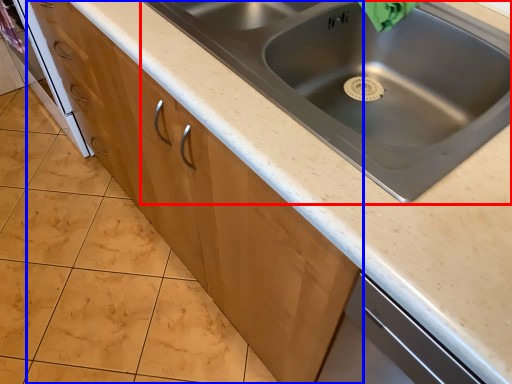
Question: Among these objects, which one is nearest to the camera, sink (highlighted by a red box) or cabinetry (highlighted by a blue box)?

Choices:
 (A) sink
 (B) cabinetry

Answer: (A)